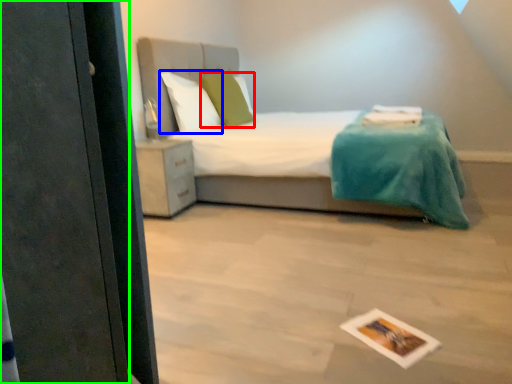
Question: Which object is the closest to the pillow (highlighted by a red box)? Choose among these: pillow (highlighted by a blue box) or screen door (highlighted by a green box).

Choices:
 (A) pillow
 (B) screen door

Answer: (A)